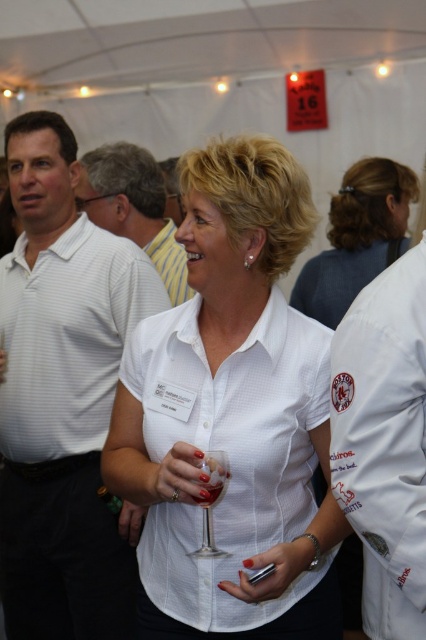
Question: Estimate the real-world distances between objects in this image. Which object is farther from the white striped polo shirt at left?

Choices:
 (A) clear glass at center
 (B) clear glass wine glass at center

Answer: (A)

Question: Where is white woven shirt at center located in relation to clear glass wine glass at center in the image?

Choices:
 (A) above
 (B) below

Answer: (A)

Question: Which is farther from the white woven shirt at center?

Choices:
 (A) white shirt at center
 (B) clear glass at center
 (C) white striped shirt at upper left

Answer: (A)

Question: Which object is positioned closest to the white woven shirt at center?

Choices:
 (A) white cotton shirt at center
 (B) white striped polo shirt at left
 (C) white striped shirt at left
 (D) clear glass at center

Answer: (A)

Question: Can you confirm if white shirt at center is thinner than white striped shirt at upper left?

Choices:
 (A) no
 (B) yes

Answer: (A)

Question: Does white woven shirt at center appear on the right side of white striped shirt at upper left?

Choices:
 (A) no
 (B) yes

Answer: (B)